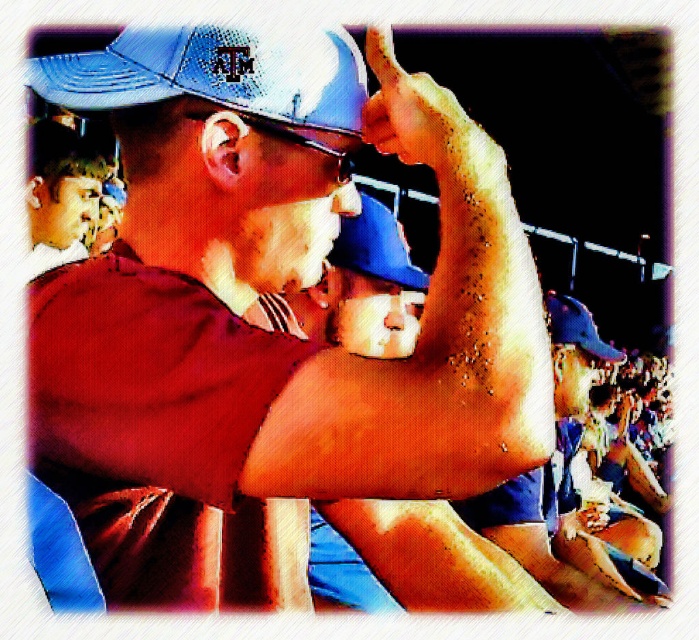
Can you confirm if matte blue cap at center is bigger than blue textured baseball cap at upper center?

Correct, matte blue cap at center is larger in size than blue textured baseball cap at upper center.

Between matte blue cap at center and blue textured baseball cap at upper center, which one appears on the left side from the viewer's perspective?

blue textured baseball cap at upper center

Who is more forward, (428, 497) or (322, 68)?

Positioned in front is point (428, 497).

Identify the location of matte blue cap at center. The image size is (699, 640). (278, 332).

Does matte blue cap at center have a lesser height compared to smooth skin arm at upper center?

No, matte blue cap at center is not shorter than smooth skin arm at upper center.

Find the location of `matte blue cap at center`. matte blue cap at center is located at coordinates (278, 332).

Locate an element on the screen. matte blue cap at center is located at coordinates (278, 332).

Between blue textured baseball cap at upper center and smooth skin arm at upper center, which one appears on the left side from the viewer's perspective?

From the viewer's perspective, smooth skin arm at upper center appears more on the left side.

In the scene shown: Does blue textured baseball cap at upper center have a greater width compared to smooth skin arm at upper center?

Indeed, blue textured baseball cap at upper center has a greater width compared to smooth skin arm at upper center.

The image size is (699, 640). What do you see at coordinates (219, 77) in the screenshot? I see `blue textured baseball cap at upper center` at bounding box center [219, 77].

This screenshot has width=699, height=640. Identify the location of blue textured baseball cap at upper center. (x=219, y=77).